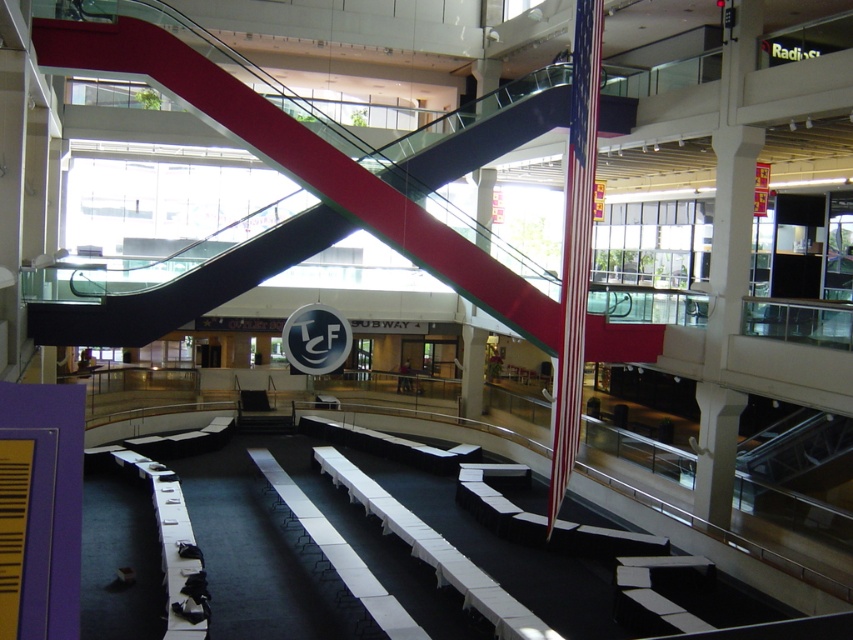
Question: Which point is farther to the camera?

Choices:
 (A) red and white striped pole at center
 (B) metallic escalator at center

Answer: (B)

Question: Is metallic escalator at center to the right of red and white striped pole at center from the viewer's perspective?

Choices:
 (A) no
 (B) yes

Answer: (A)

Question: Observing the image, what is the correct spatial positioning of metallic escalator at center in reference to red and white striped pole at center?

Choices:
 (A) below
 (B) above

Answer: (B)

Question: Does metallic escalator at center have a larger size compared to red and white striped pole at center?

Choices:
 (A) yes
 (B) no

Answer: (A)

Question: Among these points, which one is farthest from the camera?

Choices:
 (A) (579, 88)
 (B) (105, 333)

Answer: (B)